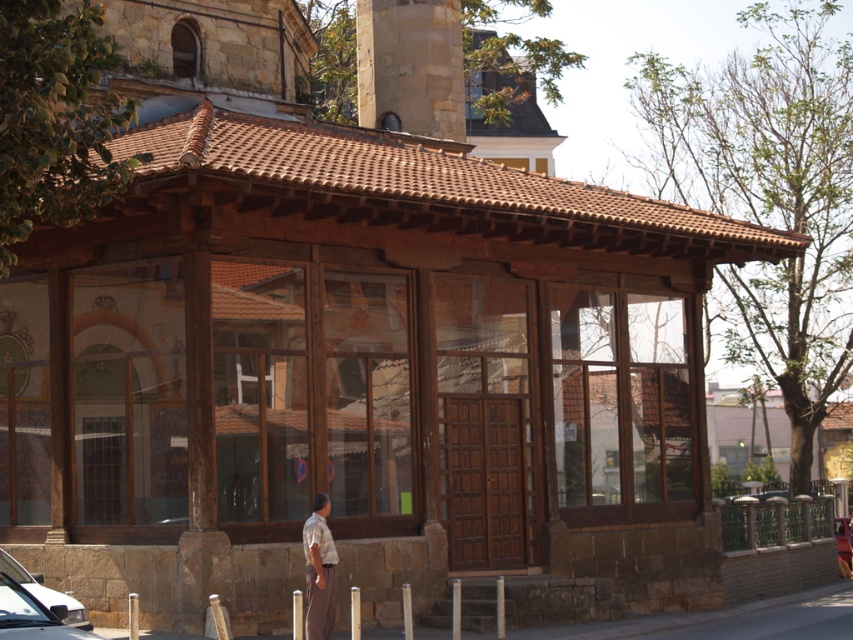
You are standing 50 feet away from the building. You want to touch the light brown fabric shirt at center. Is it possible for you to reach it without moving closer?

The light brown fabric shirt at center is 56.34 feet away from the viewer. Since you are only 50 feet away from the building, you cannot reach it without moving closer because it is further away than your current position.

You are a delivery person needing to park your vehicle in the area shown. You have a white glossy car at lower left and a metallic red car at center. Which car takes up more space horizontally in the parking spot?

The white glossy car at lower left is wider than the metallic red car at center, so it takes up more horizontal space in the parking spot.

You are standing in front of a traditional building and see a light brown fabric shirt at center and a metallic red car at center. Which object is located to the left of the other?

The light brown fabric shirt at center is positioned on the left side of metallic red car at center.